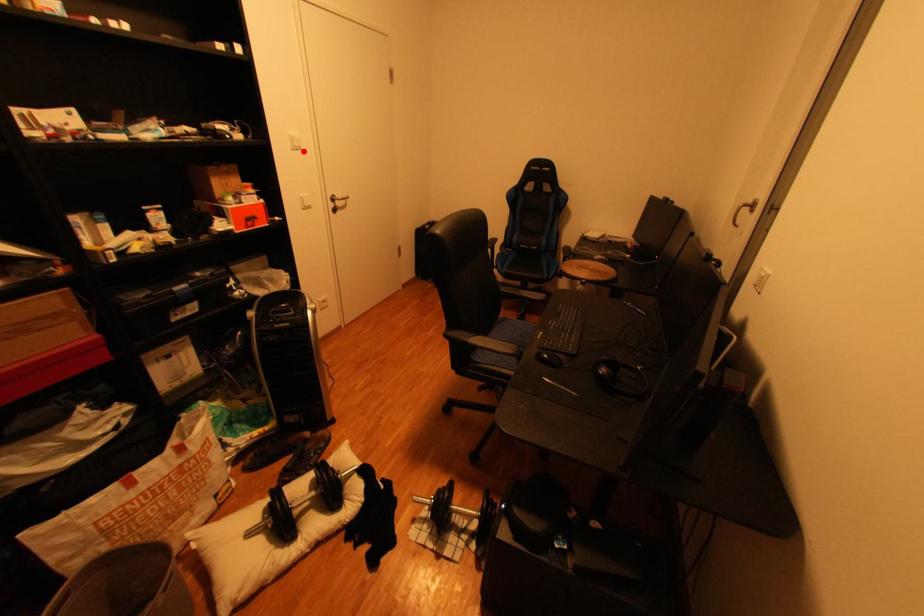
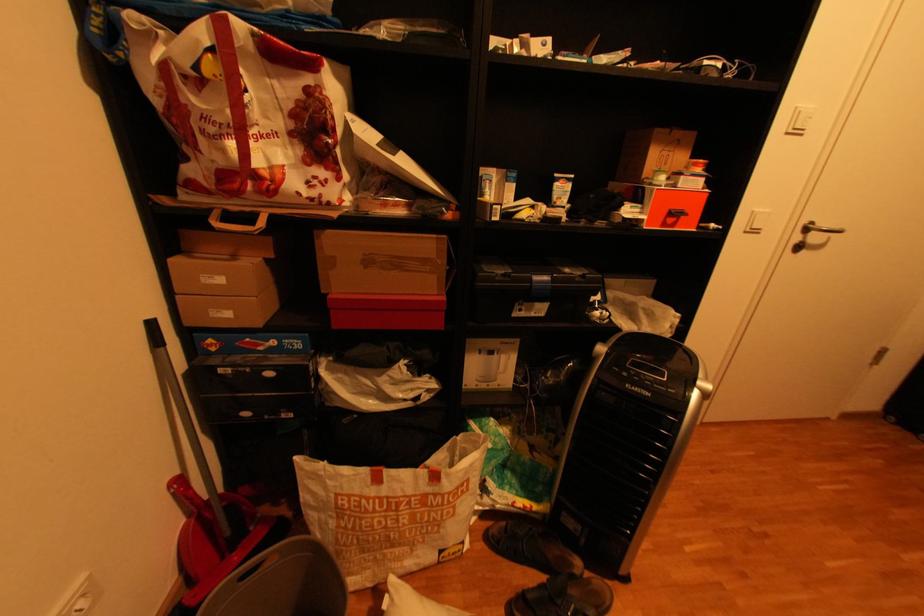
The point at the highlighted location is marked in the first image. Where is the corresponding point in the second image?

(796, 134)